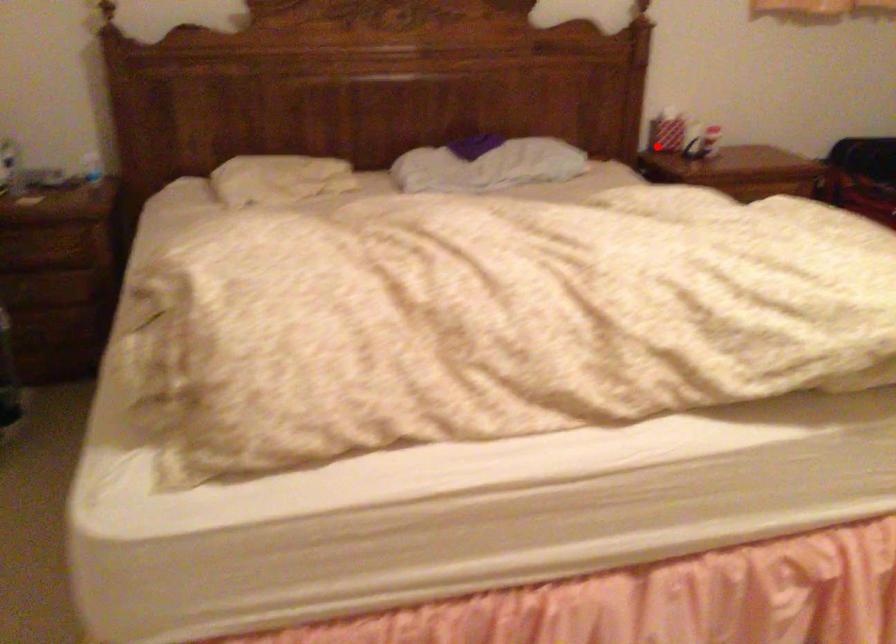
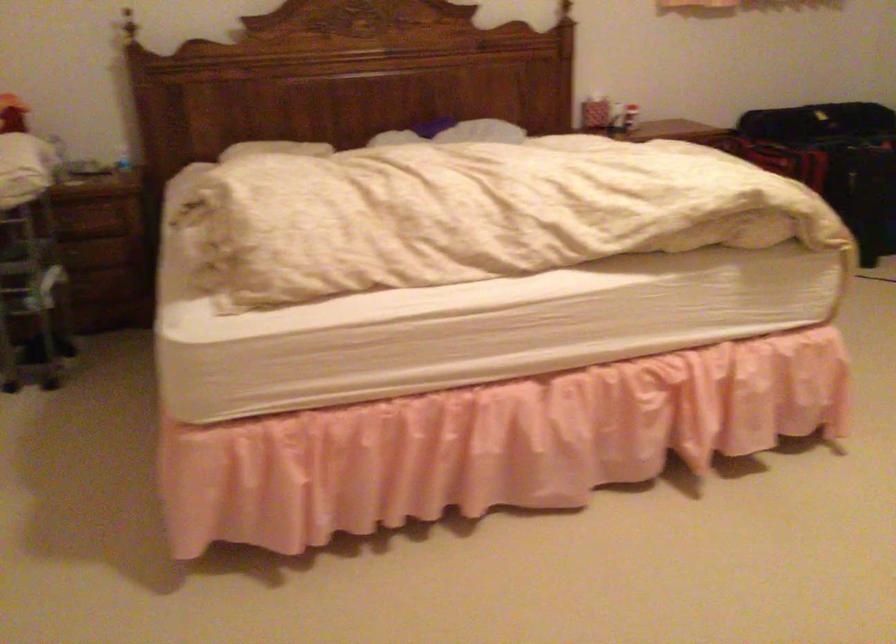
The point at the highlighted location is marked in the first image. Where is the corresponding point in the second image?

(590, 109)